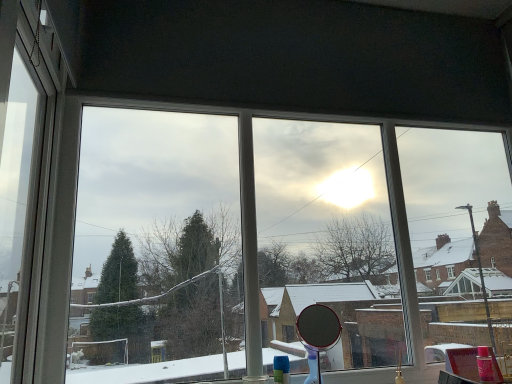
Question: Is transparent glass mirror at center further to the viewer compared to white plastic window frame at left?

Choices:
 (A) yes
 (B) no

Answer: (A)

Question: From a real-world perspective, is transparent glass mirror at center over white plastic window frame at left?

Choices:
 (A) no
 (B) yes

Answer: (A)

Question: Does transparent glass mirror at center have a larger size compared to white plastic window frame at left?

Choices:
 (A) no
 (B) yes

Answer: (B)

Question: Is transparent glass mirror at center positioned far away from white plastic window frame at left?

Choices:
 (A) no
 (B) yes

Answer: (B)

Question: Would you say white plastic window frame at left is part of transparent glass mirror at center's contents?

Choices:
 (A) no
 (B) yes

Answer: (A)

Question: Is transparent glass mirror at center oriented towards white plastic window frame at left?

Choices:
 (A) yes
 (B) no

Answer: (A)

Question: Considering the relative sizes of white plastic window frame at left and polished silver mirror at center in the image provided, is white plastic window frame at left taller than polished silver mirror at center?

Choices:
 (A) yes
 (B) no

Answer: (A)

Question: Is polished silver mirror at center located within white plastic window frame at left?

Choices:
 (A) yes
 (B) no

Answer: (B)

Question: Is white plastic window frame at left behind polished silver mirror at center?

Choices:
 (A) yes
 (B) no

Answer: (B)

Question: Can you confirm if white plastic window frame at left is thinner than polished silver mirror at center?

Choices:
 (A) no
 (B) yes

Answer: (B)

Question: Is white plastic window frame at left not close to polished silver mirror at center?

Choices:
 (A) yes
 (B) no

Answer: (A)

Question: Is white plastic window frame at left closer to the viewer compared to polished silver mirror at center?

Choices:
 (A) yes
 (B) no

Answer: (A)

Question: From a real-world perspective, does white plastic window frame at left sit lower than transparent glass mirror at center?

Choices:
 (A) yes
 (B) no

Answer: (B)